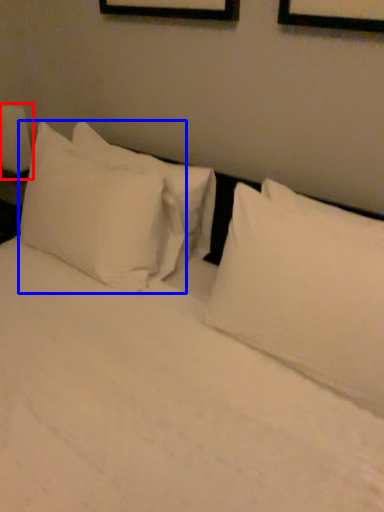
Question: Which object is further to the camera taking this photo, bedside lamp (highlighted by a red box) or pillow (highlighted by a blue box)?

Choices:
 (A) bedside lamp
 (B) pillow

Answer: (A)